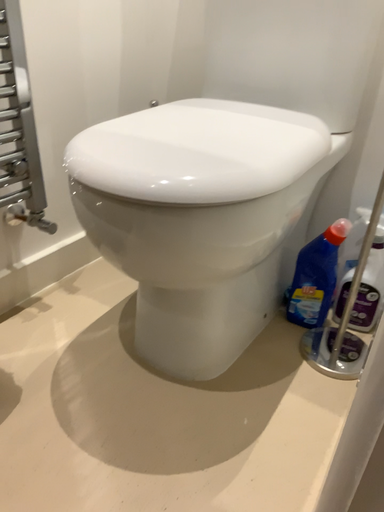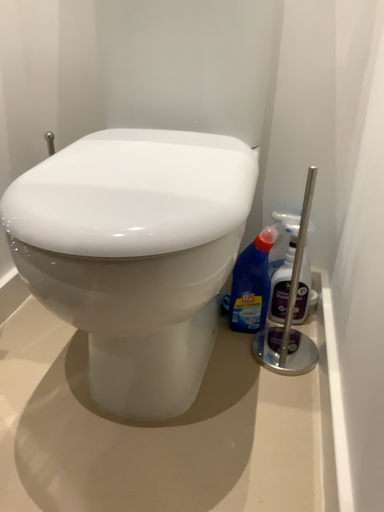
Question: How did the camera likely rotate when shooting the video?

Choices:
 (A) rotated right
 (B) rotated left

Answer: (A)